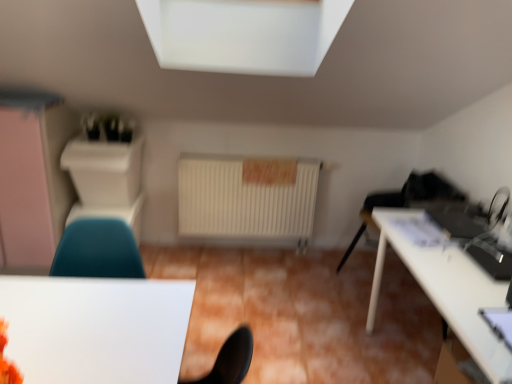
Question: Looking at the image, does white glossy table at right, the second table positioned from the left, seem bigger or smaller compared to teal fabric chair at lower left?

Choices:
 (A) small
 (B) big

Answer: (B)

Question: Is point [396, 216] positioned closer to the camera than point [61, 273]?

Choices:
 (A) farther
 (B) closer

Answer: (A)

Question: Estimate the real-world distances between objects in this image. Which object is farther from the teal fabric chair at lower left?

Choices:
 (A) white glossy table at lower left, which ranks as the 1th table in left-to-right order
 (B) white glossy table at right, the second table positioned from the left
 (C) matte white dresser at left

Answer: (B)

Question: Which is nearer to the white glossy table at lower left, the 2th table from the right?

Choices:
 (A) teal fabric chair at lower left
 (B) white glossy table at right, the second table positioned from the left
 (C) matte white dresser at left

Answer: (A)